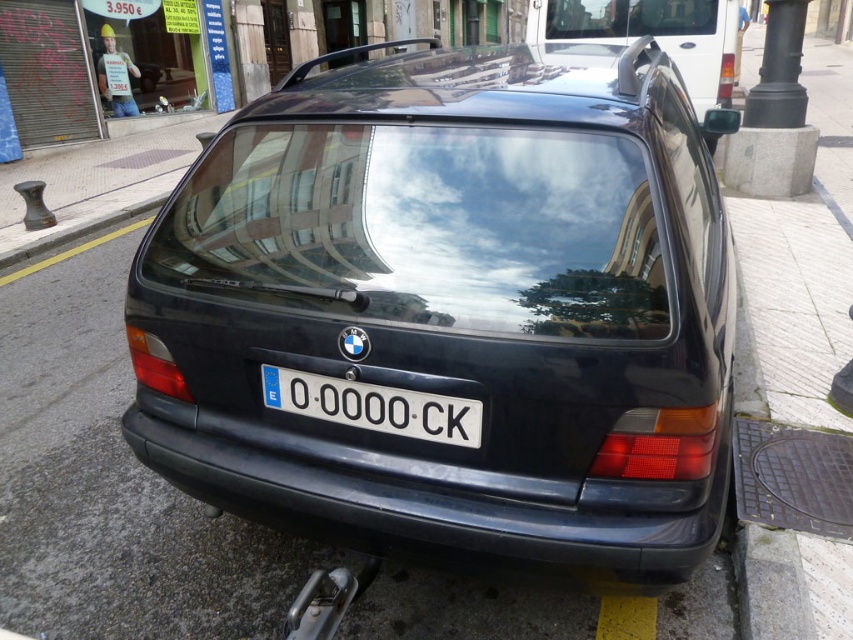
Does glossy black roof rack at upper right have a greater width compared to white plastic license plate at center?

Yes, glossy black roof rack at upper right is wider than white plastic license plate at center.

Is glossy black roof rack at upper right thinner than white plastic license plate at center?

No, glossy black roof rack at upper right is not thinner than white plastic license plate at center.

Is point (680, 38) positioned after point (352, 392)?

Yes, it is behind point (352, 392).

Find the location of a particular element. The height and width of the screenshot is (640, 853). glossy black roof rack at upper right is located at coordinates [654, 35].

Can you confirm if glossy black car at center is positioned to the left of white plastic license plate at center?

In fact, glossy black car at center is to the right of white plastic license plate at center.

Is glossy black car at center thinner than white plastic license plate at center?

In fact, glossy black car at center might be wider than white plastic license plate at center.

Is point (695, 403) positioned in front of point (369, 412)?

Yes, it is in front of point (369, 412).

The image size is (853, 640). In order to click on glossy black car at center in this screenshot , I will do `click(451, 310)`.

What are the coordinates of `glossy black car at center` in the screenshot? It's located at (451, 310).

Does glossy black car at center come in front of glossy black roof rack at upper right?

That is True.

Which is behind, point (711, 212) or point (694, 26)?

The point (694, 26) is more distant.

Find the location of a particular element. glossy black car at center is located at coordinates (451, 310).